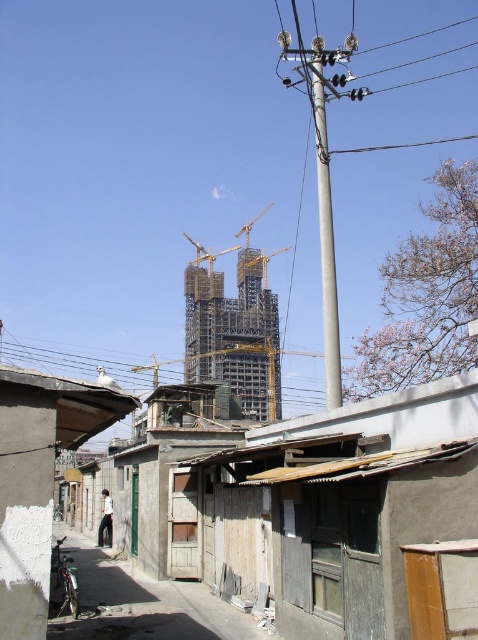
Question: Which object appears closest to the camera in this image?

Choices:
 (A) metallic scaffolding tower at center
 (B) gray metallic pole at center

Answer: (B)

Question: Which object is positioned closest to the silver metallic motorcycle at lower left?

Choices:
 (A) metallic scaffolding tower at center
 (B) gray metallic pole at center

Answer: (B)

Question: Does gray metallic pole at center have a greater width compared to silver metallic motorcycle at lower left?

Choices:
 (A) yes
 (B) no

Answer: (A)

Question: Is gray metallic pole at center closer to the viewer compared to silver metallic motorcycle at lower left?

Choices:
 (A) yes
 (B) no

Answer: (B)

Question: Which is nearer to the metallic bicycle at lower left?

Choices:
 (A) metallic scaffolding tower at center
 (B) gray metallic pole at center

Answer: (B)

Question: Is metallic bicycle at lower left below gray metallic pole at center?

Choices:
 (A) yes
 (B) no

Answer: (A)